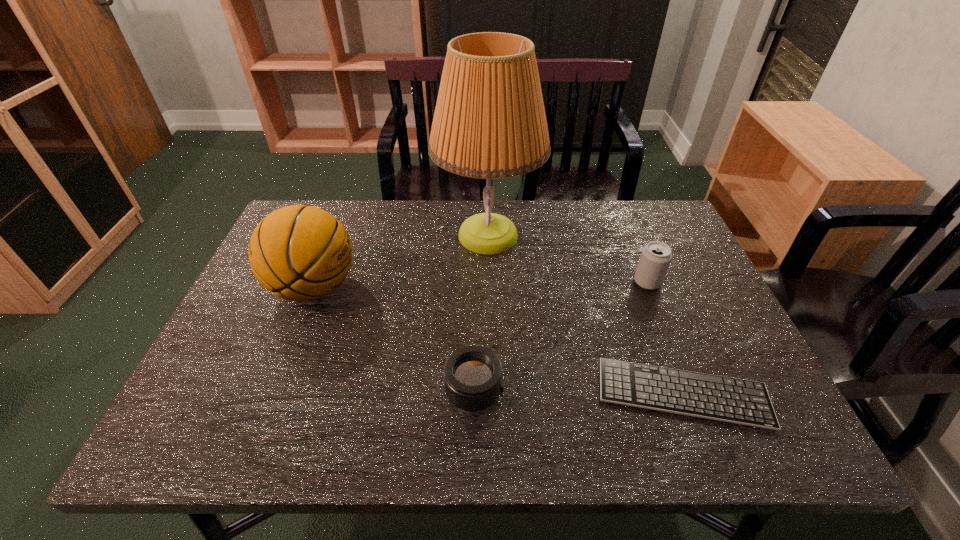
The width and height of the screenshot is (960, 540). What are the coordinates of `free point located on the front of the third tallest object` in the screenshot? It's located at (671, 341).

Identify the location of vacant space located 0.330m on the side of the telephoto lens with brand markings and control switches. (662, 390).

Locate an element on the screen. free region located 0.120m on the left of the computer keyboard is located at coordinates (540, 393).

Identify the location of object that is at the far edge. The height and width of the screenshot is (540, 960). (489, 122).

The width and height of the screenshot is (960, 540). Identify the location of telephoto lens that is at the near edge. (473, 375).

Locate an element on the screen. computer keyboard positioned at the near edge is located at coordinates (740, 401).

You are a GUI agent. You are given a task and a screenshot of the screen. Output one action in this format:
    pyautogui.click(x=<x>, y=<y>)
    Task: Click on the object that is at the left edge
    
    Given the screenshot: What is the action you would take?
    pyautogui.click(x=300, y=253)

In order to click on can positioned at the right edge in this screenshot , I will do `click(655, 258)`.

Locate an element on the screen. Image resolution: width=960 pixels, height=540 pixels. computer keyboard that is at the right edge is located at coordinates (740, 401).

Find the location of a particular element. This screenshot has height=540, width=960. object that is at the near right corner is located at coordinates (740, 401).